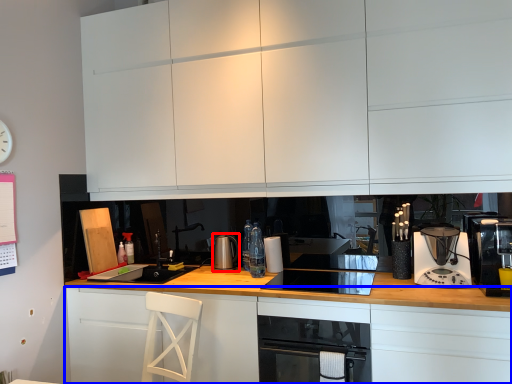
Question: Among these objects, which one is farthest to the camera, kitchen appliance (highlighted by a red box) or cabinetry (highlighted by a blue box)?

Choices:
 (A) kitchen appliance
 (B) cabinetry

Answer: (A)